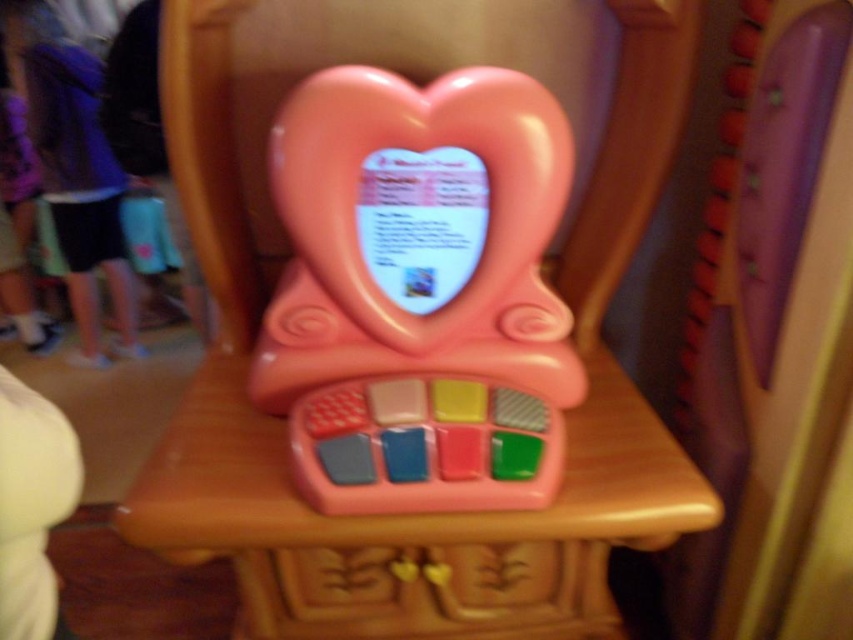
Does pink plastic chair at center lie in front of pink plastic toy at center?

No, it is not.

Identify the location of pink plastic chair at center. Image resolution: width=853 pixels, height=640 pixels. (283, 424).

Which is behind, point (573, 518) or point (306, 202)?

The point (306, 202) is more distant.

Locate an element on the screen. This screenshot has width=853, height=640. pink plastic chair at center is located at coordinates (283, 424).